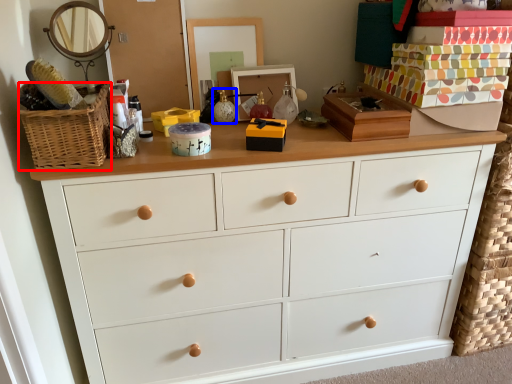
Question: Among these objects, which one is nearest to the camera, basket (highlighted by a red box) or toy (highlighted by a blue box)?

Choices:
 (A) basket
 (B) toy

Answer: (A)